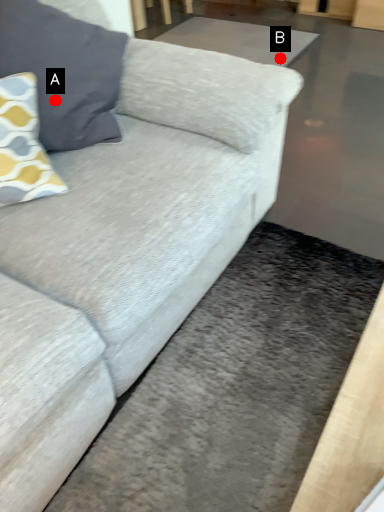
Question: Two points are circled on the image, labeled by A and B beside each circle. Which point is further to the camera?

Choices:
 (A) A is further
 (B) B is further

Answer: (B)